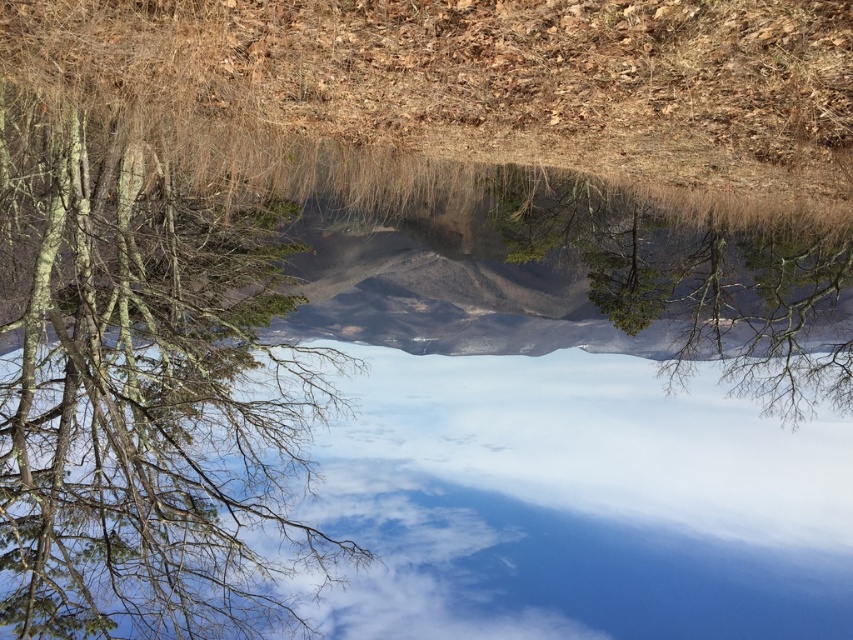
In the scene shown: Based on the scene, which object occupies a greater area in the image? Please choose between the cloudy sky at center and the green matte tree at center.

The cloudy sky at center is larger in size than the green matte tree at center, so the cloudy sky at center occupies a greater area in the image.

You are standing at the edge of the lake and see the barky brown tree at left and the cloudy sky at center. Which object is closer to you, the observer?

The barky brown tree at left is closer to you because it is positioned over the cloudy sky at center, meaning it is in front of the sky in the reflection.